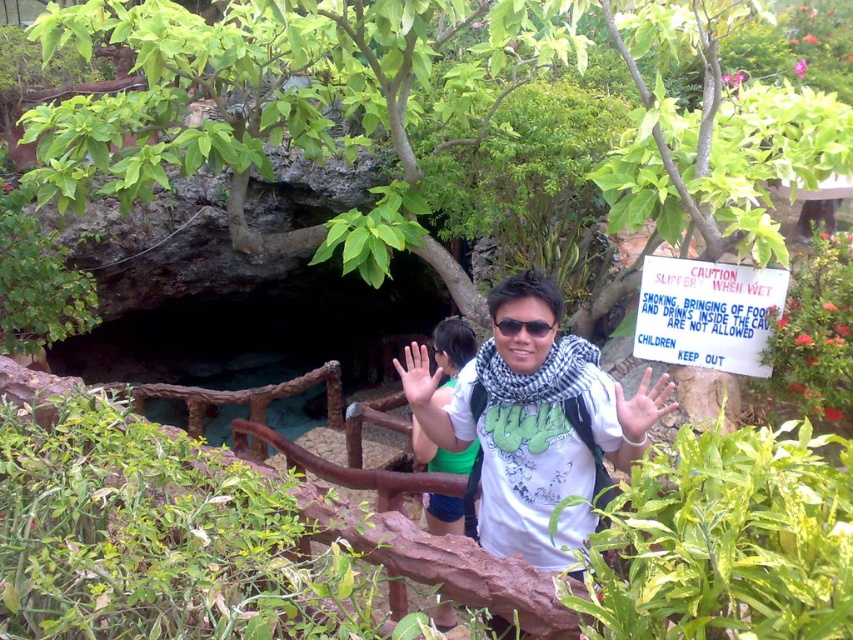
Is white cotton shirt at center to the right of white paper sign at center right from the viewer's perspective?

Incorrect, white cotton shirt at center is not on the right side of white paper sign at center right.

Which is behind, point (459, 413) or point (639, 323)?

Positioned behind is point (639, 323).

Is point (581, 544) positioned after point (712, 365)?

No, (581, 544) is in front of (712, 365).

Locate an element on the screen. This screenshot has width=853, height=640. white cotton shirt at center is located at coordinates (532, 426).

How much distance is there between white matte hand at center and smooth skin hand at center?

3.63 meters

Between white matte hand at center and smooth skin hand at center, which one is positioned higher?

white matte hand at center is above.

Is point (663, 376) positioned before point (422, 406)?

Yes, point (663, 376) is closer to viewer.

Locate an element on the screen. The width and height of the screenshot is (853, 640). white matte hand at center is located at coordinates (642, 406).

Between white cotton shirt at center and smooth skin hand at center, which one is positioned higher?

Positioned higher is white cotton shirt at center.

Between white cotton shirt at center and smooth skin hand at center, which one has less height?

smooth skin hand at center is shorter.

This screenshot has width=853, height=640. I want to click on white cotton shirt at center, so point(532,426).